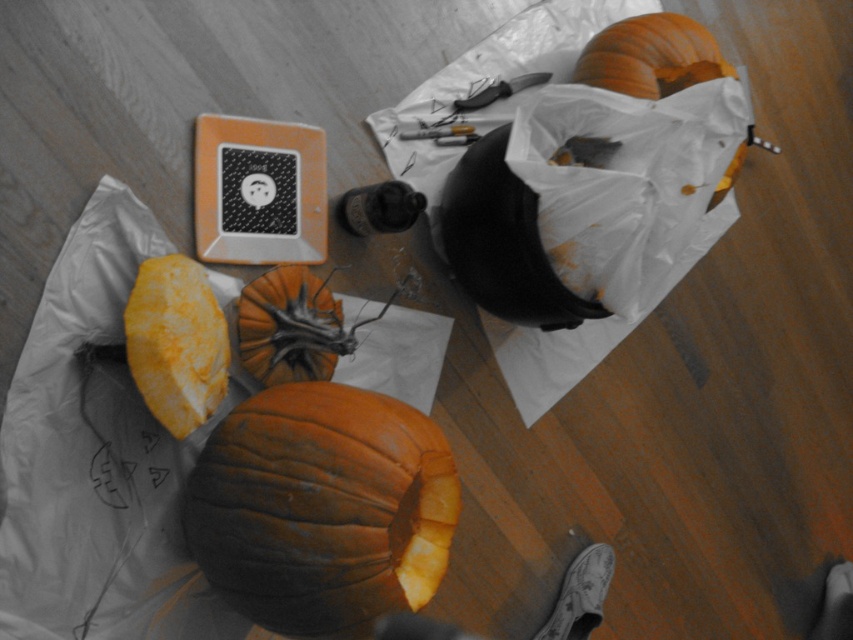
Question: Estimate the real-world distances between objects in this image. Which object is closer to the orange rough pumpkin at center?

Choices:
 (A) orange matte pumpkin at lower left
 (B) orange matte pumpkin at center

Answer: (A)

Question: Where is orange matte pumpkin at lower left located in relation to orange rough pumpkin at center in the image?

Choices:
 (A) below
 (B) above

Answer: (A)

Question: Which object appears farthest from the camera in this image?

Choices:
 (A) orange matte pumpkin at lower left
 (B) orange matte pumpkin at center
 (C) orange rough pumpkin at center

Answer: (C)

Question: Is orange matte pumpkin at lower left to the left of orange rough pumpkin at center from the viewer's perspective?

Choices:
 (A) yes
 (B) no

Answer: (A)

Question: Which of the following is the farthest from the observer?

Choices:
 (A) orange matte pumpkin at upper right
 (B) orange matte pumpkin at center

Answer: (A)

Question: Can you confirm if orange matte pumpkin at center is bigger than orange rough pumpkin at center?

Choices:
 (A) no
 (B) yes

Answer: (B)